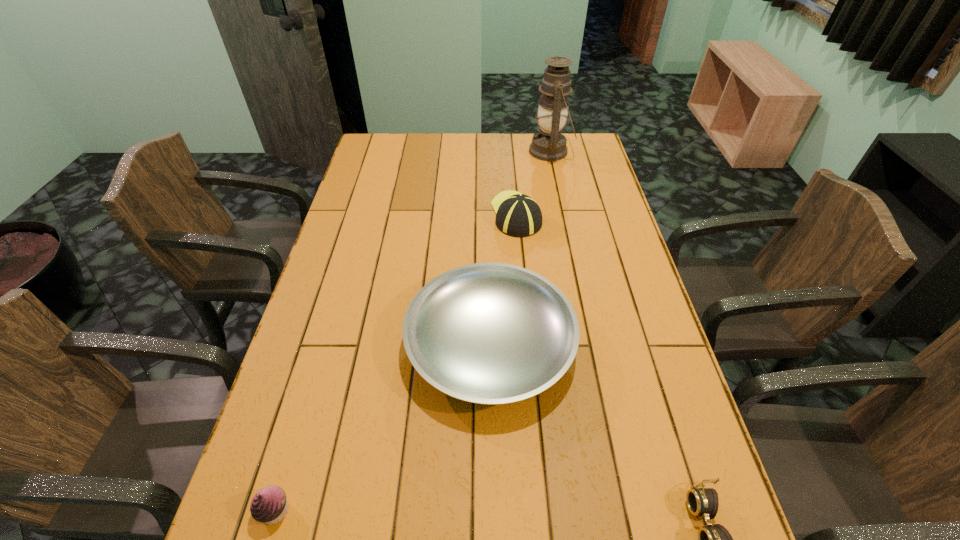
I want to click on vacant space that is in between the bedpan and the leftmost object, so click(x=383, y=427).

You are a GUI agent. You are given a task and a screenshot of the screen. Output one action in this format:
    pyautogui.click(x=<x>, y=<y>)
    Task: Click on the free space between the third nearest object and the tallest object
    The image size is (960, 540).
    Given the screenshot: What is the action you would take?
    pyautogui.click(x=520, y=248)

You are a GUI agent. You are given a task and a screenshot of the screen. Output one action in this format:
    pyautogui.click(x=<x>, y=<y>)
    Task: Click on the vacant area that lies between the third farthest object and the cupcake
    
    Given the screenshot: What is the action you would take?
    pyautogui.click(x=383, y=427)

Choose which object is the third nearest neighbor to the oil lamp. Please provide its 2D coordinates. Your answer should be formatted as a tuple, i.e. [(x, y)], where the tuple contains the x and y coordinates of a point satisfying the conditions above.

[(702, 502)]

Point out which object is positioned as the nearest to the baseball cap. Please provide its 2D coordinates. Your answer should be formatted as a tuple, i.e. [(x, y)], where the tuple contains the x and y coordinates of a point satisfying the conditions above.

[(549, 144)]